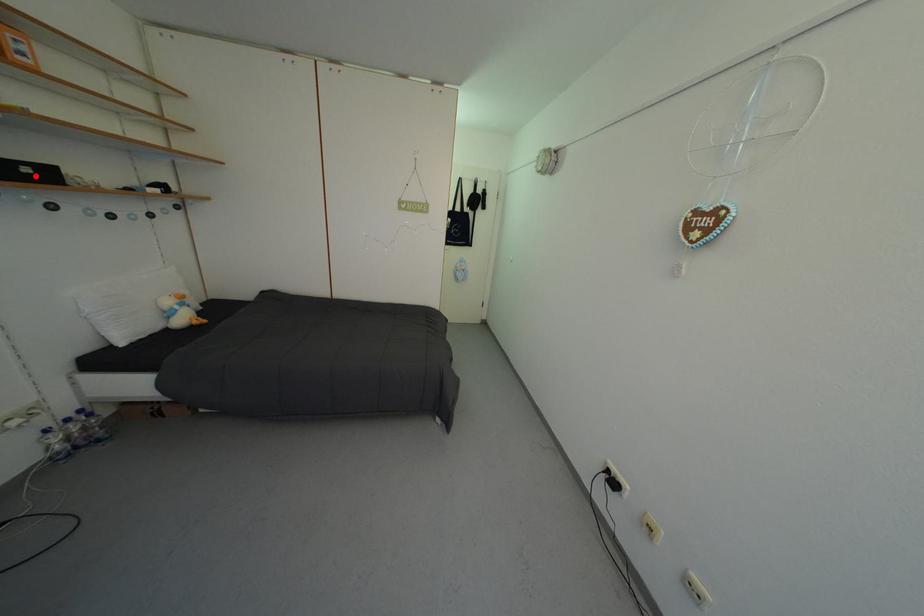
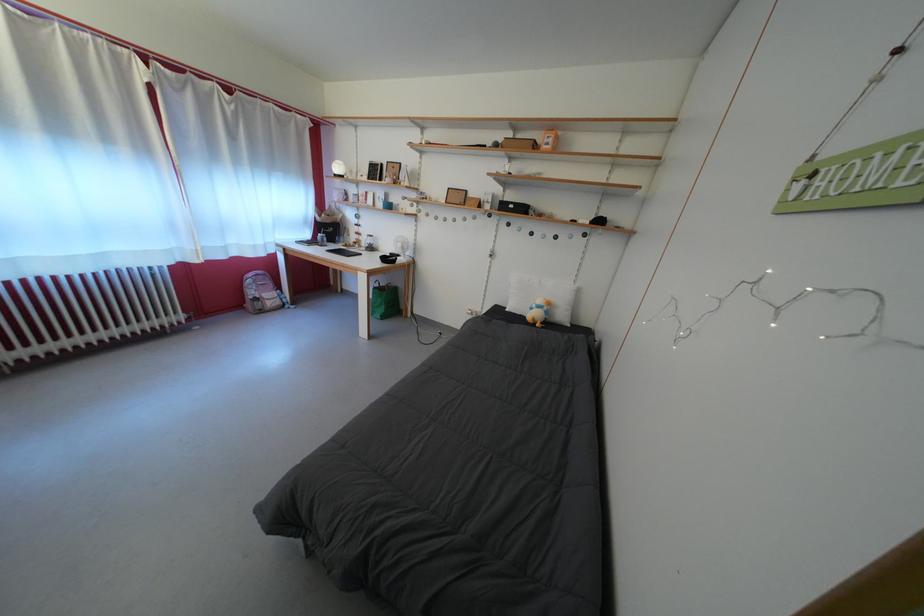
The point at the highlighted location is marked in the first image. Where is the corresponding point in the second image?

(519, 213)